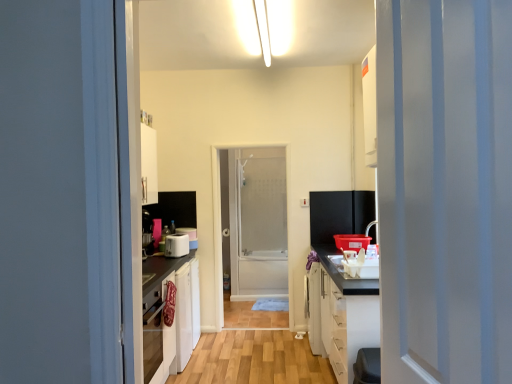
Question: From the image's perspective, is white plastic toaster at center, which ranks as the 2th appliance in back-to-front order, beneath white matte cabinet at right?

Choices:
 (A) no
 (B) yes

Answer: (A)

Question: Can you confirm if white plastic toaster at center, which ranks as the 2th appliance in back-to-front order, is smaller than white matte cabinet at right?

Choices:
 (A) yes
 (B) no

Answer: (A)

Question: Considering the relative sizes of white plastic toaster at center, arranged as the first appliance when viewed from the front, and white matte cabinet at right in the image provided, is white plastic toaster at center, arranged as the first appliance when viewed from the front, shorter than white matte cabinet at right?

Choices:
 (A) no
 (B) yes

Answer: (B)

Question: Is white plastic toaster at center, which ranks as the 2th appliance in back-to-front order, positioned before white matte cabinet at right?

Choices:
 (A) no
 (B) yes

Answer: (B)

Question: Is white matte cabinet at right surrounded by white plastic toaster at center, which ranks as the 2th appliance in back-to-front order?

Choices:
 (A) yes
 (B) no

Answer: (B)

Question: From a real-world perspective, is white plastic toaster at center, arranged as the first appliance when viewed from the front, positioned under white matte cabinet at right based on gravity?

Choices:
 (A) no
 (B) yes

Answer: (A)

Question: Would you say white plastic toaster at center, which is counted as the 1th appliance, starting from the back, is outside white plastic toaster at center, arranged as the first appliance when viewed from the front?

Choices:
 (A) yes
 (B) no

Answer: (A)

Question: Would you say white plastic toaster at center, which is counted as the 1th appliance, starting from the back, contains white plastic toaster at center, which ranks as the 2th appliance in back-to-front order?

Choices:
 (A) yes
 (B) no

Answer: (B)

Question: Can you confirm if white plastic toaster at center, which is counted as the 1th appliance, starting from the back, is positioned to the right of white plastic toaster at center, which ranks as the 2th appliance in back-to-front order?

Choices:
 (A) yes
 (B) no

Answer: (A)

Question: From the image's perspective, is white plastic toaster at center, which is the 2th appliance in front-to-back order, beneath white plastic toaster at center, which ranks as the 2th appliance in back-to-front order?

Choices:
 (A) yes
 (B) no

Answer: (B)

Question: From a real-world perspective, is white plastic toaster at center, which is the 2th appliance in front-to-back order, on top of white plastic toaster at center, arranged as the first appliance when viewed from the front?

Choices:
 (A) no
 (B) yes

Answer: (B)

Question: Is white plastic toaster at center, which is counted as the 1th appliance, starting from the back, smaller than white plastic toaster at center, arranged as the first appliance when viewed from the front?

Choices:
 (A) yes
 (B) no

Answer: (A)

Question: From the image's perspective, is white plastic toaster at center, which is the 2th appliance in front-to-back order, under white plastic electric outlet at center?

Choices:
 (A) no
 (B) yes

Answer: (B)